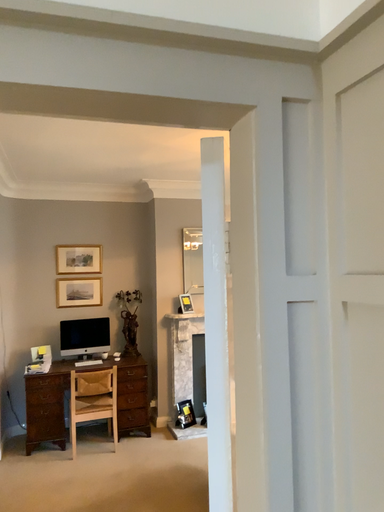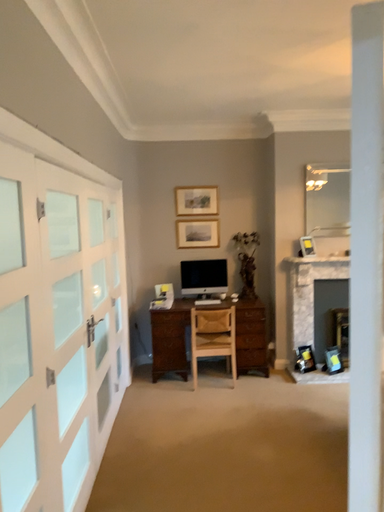
Question: Which way did the camera rotate in the video?

Choices:
 (A) rotated downward
 (B) rotated upward

Answer: (A)